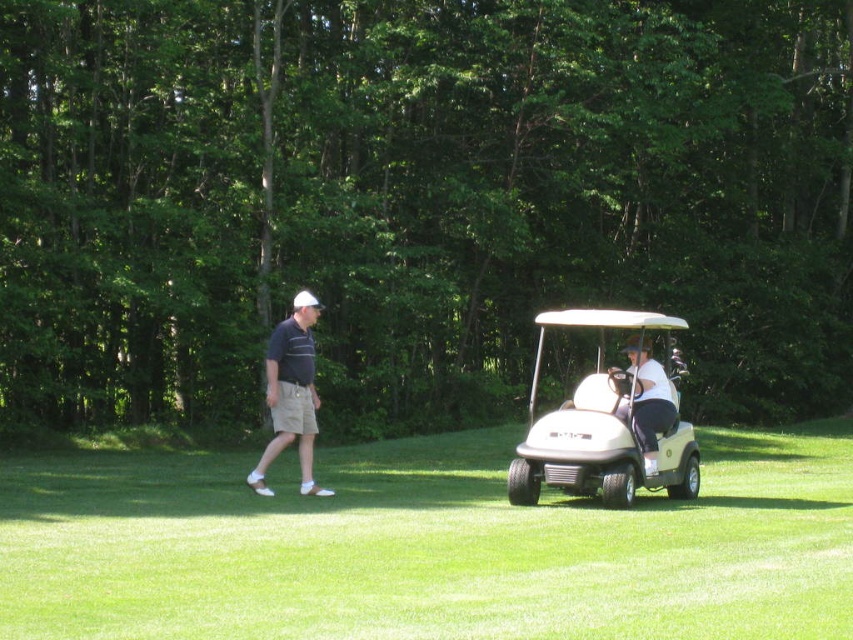
Does white matte golf cart at center come behind beige matte golf cart at right?

No, white matte golf cart at center is in front of beige matte golf cart at right.

Does white matte golf cart at center have a lesser width compared to beige matte golf cart at right?

No, white matte golf cart at center is not thinner than beige matte golf cart at right.

Who is more forward, (627, 516) or (662, 451)?

Point (627, 516) is in front.

You are a GUI agent. You are given a task and a screenshot of the screen. Output one action in this format:
    pyautogui.click(x=<x>, y=<y>)
    Task: Click on the white matte golf cart at center
    This screenshot has height=640, width=853.
    Given the screenshot: What is the action you would take?
    pyautogui.click(x=427, y=547)

How far apart are matte black shirt at left and light green plastic golf cart at center?

3.14 meters

Can you confirm if matte black shirt at left is bigger than light green plastic golf cart at center?

No, matte black shirt at left is not bigger than light green plastic golf cart at center.

Which is behind, point (306, 404) or point (628, 342)?

The point (628, 342) is behind.

The width and height of the screenshot is (853, 640). Identify the location of matte black shirt at left. (291, 394).

Describe the element at coordinates (602, 424) in the screenshot. The width and height of the screenshot is (853, 640). I see `beige matte golf cart at right` at that location.

Does beige matte golf cart at right have a larger size compared to matte black shirt at left?

Correct, beige matte golf cart at right is larger in size than matte black shirt at left.

Who is more distant from viewer, (566, 308) or (279, 440)?

Positioned behind is point (566, 308).

Locate an element on the screen. beige matte golf cart at right is located at coordinates (602, 424).